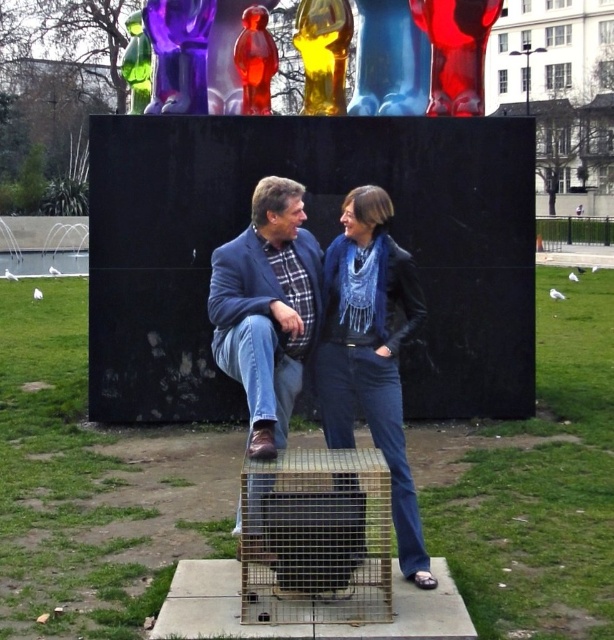
Question: Which point appears closest to the camera in this image?

Choices:
 (A) (371, 272)
 (B) (233, 374)

Answer: (B)

Question: Which of the following is the closest to the observer?

Choices:
 (A) (286, 401)
 (B) (367, 237)

Answer: (A)

Question: Does blue denim scarf at center appear on the right side of matte blue jacket at center?

Choices:
 (A) no
 (B) yes

Answer: (B)

Question: Does blue denim scarf at center appear on the left side of matte blue jacket at center?

Choices:
 (A) no
 (B) yes

Answer: (A)

Question: Does blue denim scarf at center have a larger size compared to matte blue jacket at center?

Choices:
 (A) no
 (B) yes

Answer: (A)

Question: Which point is closer to the camera?

Choices:
 (A) (265, 337)
 (B) (362, 308)

Answer: (A)